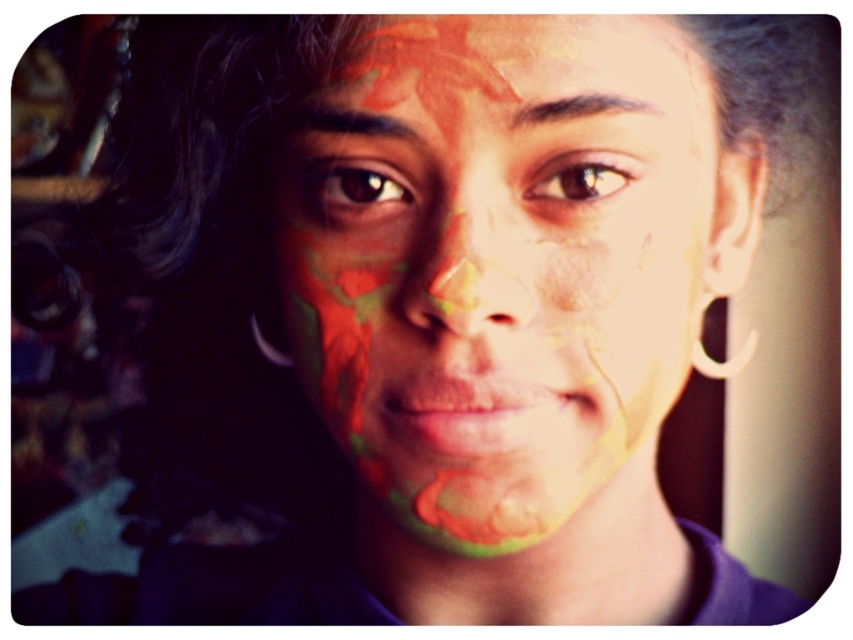
Question: Among these points, which one is nearest to the camera?

Choices:
 (A) (312, 202)
 (B) (608, 182)

Answer: (B)

Question: From the image, what is the correct spatial relationship of multicolored paint at center in relation to brown matte eye at center?

Choices:
 (A) right
 (B) left

Answer: (A)

Question: Which object is farther from the camera taking this photo?

Choices:
 (A) brown matte eye at upper center
 (B) brown matte eye at center

Answer: (B)

Question: Is multicolored paint at center below brown matte eye at upper center?

Choices:
 (A) no
 (B) yes

Answer: (B)

Question: Which of the following is the closest to the observer?

Choices:
 (A) (318, 173)
 (B) (619, 173)
 (C) (704, 224)

Answer: (B)

Question: Considering the relative positions of multicolored paint at center and brown matte eye at upper center in the image provided, where is multicolored paint at center located with respect to brown matte eye at upper center?

Choices:
 (A) above
 (B) below

Answer: (B)